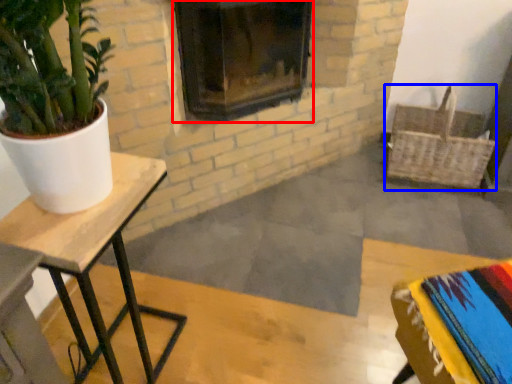
Question: Which point is further to the camera, fireplace (highlighted by a red box) or basket (highlighted by a blue box)?

Choices:
 (A) fireplace
 (B) basket

Answer: (B)